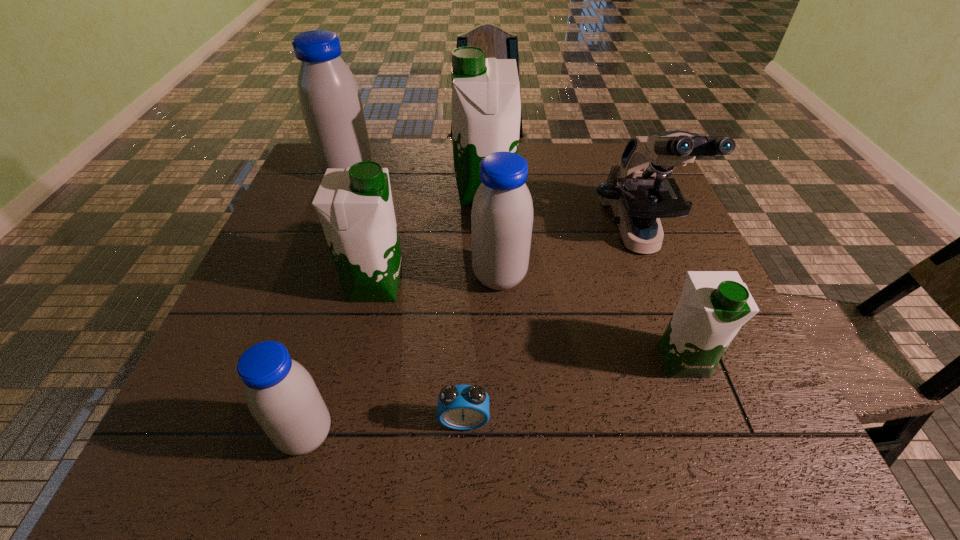
Identify the location of the smallest blue soya milk. The image size is (960, 540). (281, 395).

At what (x,y) coordinates should I click in order to perform the action: click on the nearest blue soya milk. Please return your answer as a coordinate pair (x, y). The image size is (960, 540). Looking at the image, I should click on pos(281,395).

Find the location of `alarm clock`. alarm clock is located at coordinates (460, 407).

You are a GUI agent. You are given a task and a screenshot of the screen. Output one action in this format:
    pyautogui.click(x=<x>, y=<y>)
    Task: Click on the free spot located 0.370m on the front-facing side of the biggest green soya milk
    
    Given the screenshot: What is the action you would take?
    pyautogui.click(x=324, y=192)

You are a GUI agent. You are given a task and a screenshot of the screen. Output one action in this format:
    pyautogui.click(x=<x>, y=<y>)
    Task: Click on the vacant space located on the front-facing side of the biggest green soya milk
    The height and width of the screenshot is (540, 960).
    Given the screenshot: What is the action you would take?
    pyautogui.click(x=398, y=192)

Find the location of a particular element. The width and height of the screenshot is (960, 540). vacant space positioned on the front-facing side of the biggest green soya milk is located at coordinates (338, 192).

This screenshot has width=960, height=540. I want to click on free location located 0.150m on the right of the biggest blue soya milk, so click(425, 172).

The height and width of the screenshot is (540, 960). Identify the location of free region located through the eyepieces of the microscope. (664, 309).

I want to click on free location located 0.280m on the right of the second smallest blue soya milk, so click(x=649, y=277).

Identify the location of vacant area located on the front-facing side of the second farthest green soya milk. (427, 285).